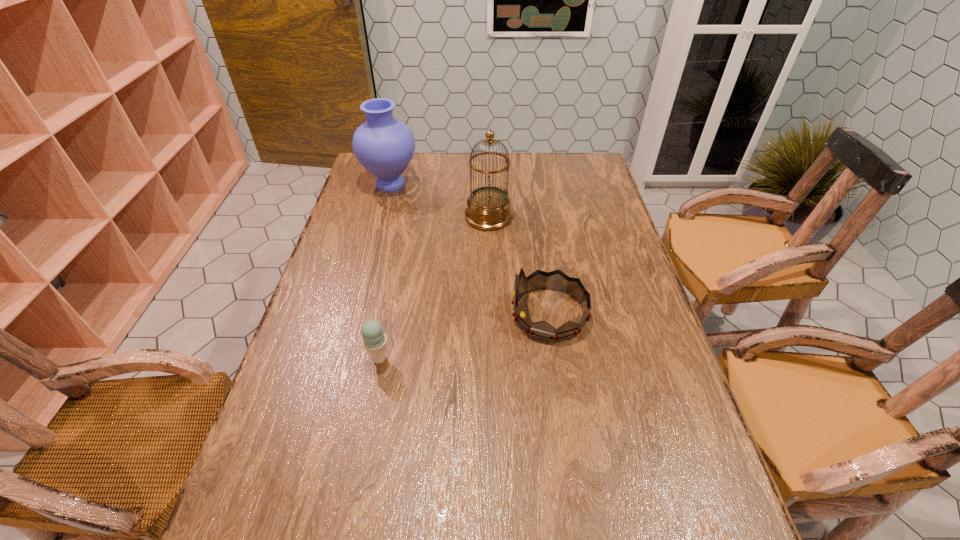
I want to click on object that is the closest to the third farthest object, so click(488, 207).

The height and width of the screenshot is (540, 960). I want to click on blank area in the image that satisfies the following two spatial constraints: 1. on the front side of the nearest object; 2. on the right side of the farthest object, so click(344, 359).

Image resolution: width=960 pixels, height=540 pixels. I want to click on vacant area in the image that satisfies the following two spatial constraints: 1. with an open door on the second farthest object; 2. on the front side of the nearest object, so click(492, 359).